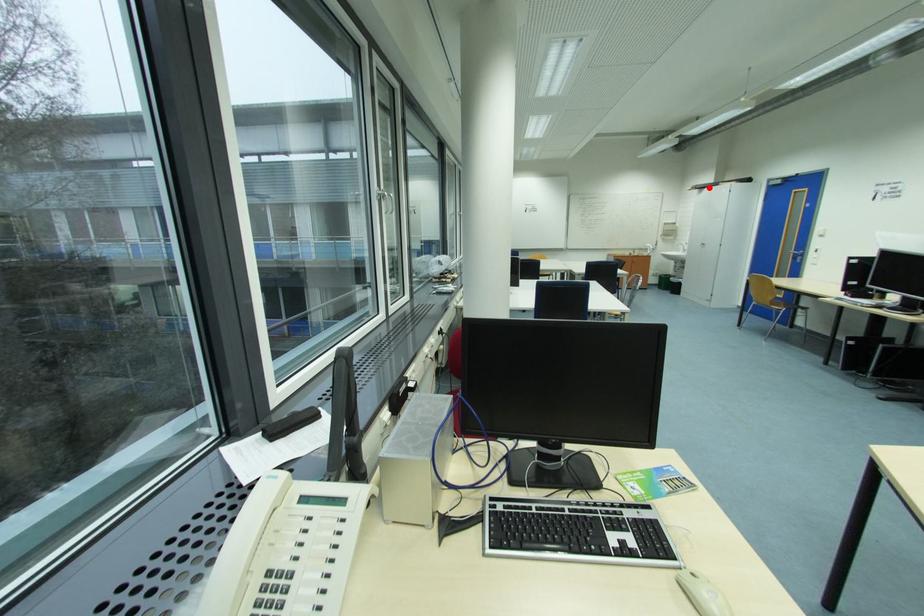
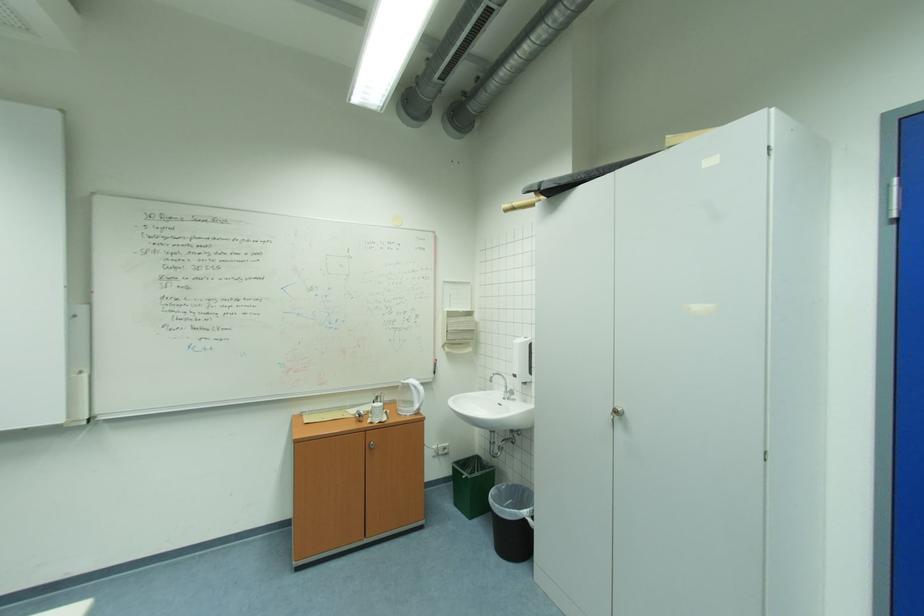
Locate, in the second image, the point that corresponds to the highlighted location in the first image.

(569, 182)